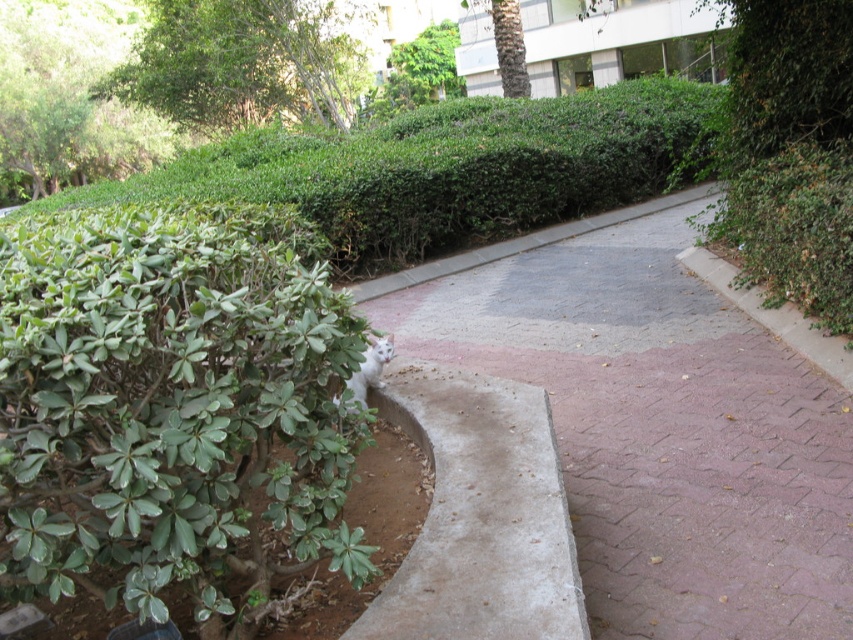
Measure the distance from pink brick pavement at center to green leafy tree at upper left.

They are 18.58 meters apart.

Can you confirm if pink brick pavement at center is taller than green leafy tree at upper left?

Incorrect, pink brick pavement at center's height is not larger of green leafy tree at upper left's.

The width and height of the screenshot is (853, 640). I want to click on pink brick pavement at center, so click(x=659, y=422).

Does green leafy hedge at upper left have a larger size compared to brown textured palm tree at upper center?

Yes, green leafy hedge at upper left is bigger than brown textured palm tree at upper center.

In the scene shown: Can you confirm if green leafy hedge at upper left is shorter than brown textured palm tree at upper center?

No.

The image size is (853, 640). I want to click on green leafy hedge at upper left, so click(450, 168).

Does pink brick pavement at center have a lesser height compared to green leafy hedge at upper left?

Yes, pink brick pavement at center is shorter than green leafy hedge at upper left.

Which is in front, point (457, 305) or point (592, 177)?

Point (457, 305)

Identify the location of pink brick pavement at center. (659, 422).